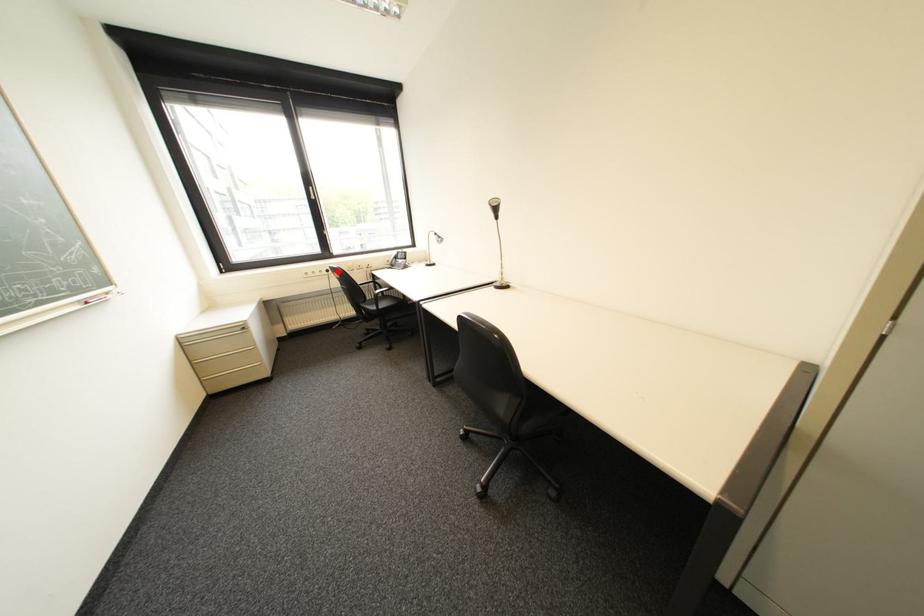
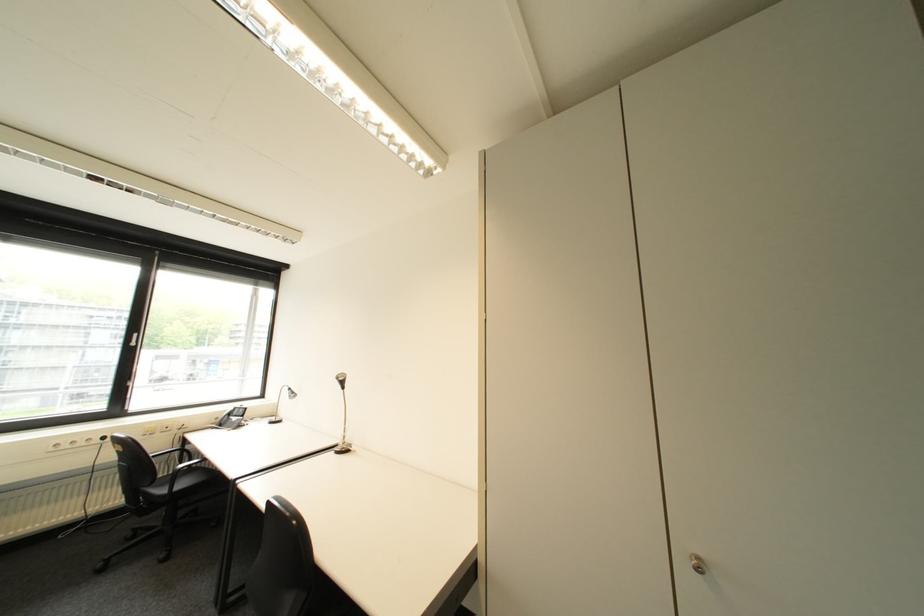
Where in the second image is the point corresponding to the highlighted location from the first image?

(114, 439)